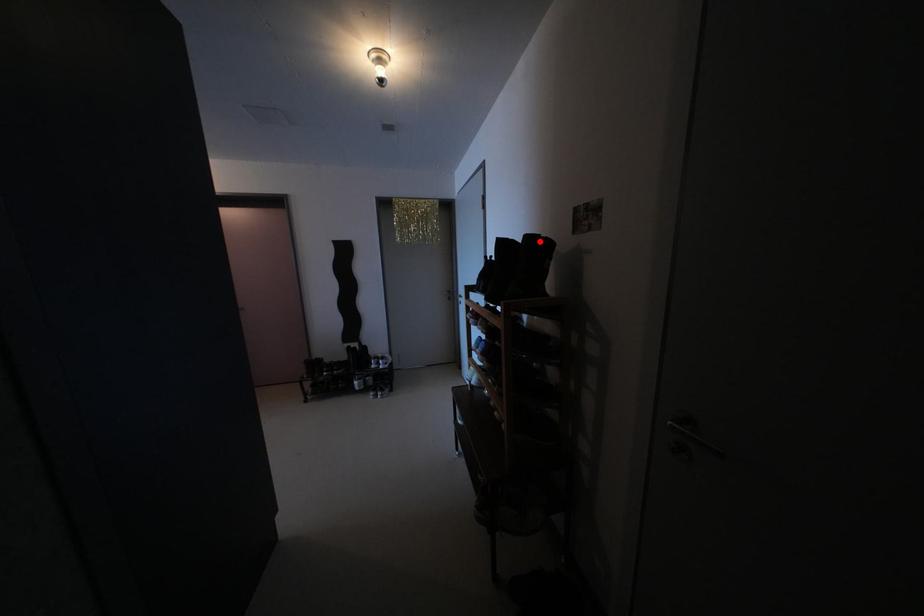
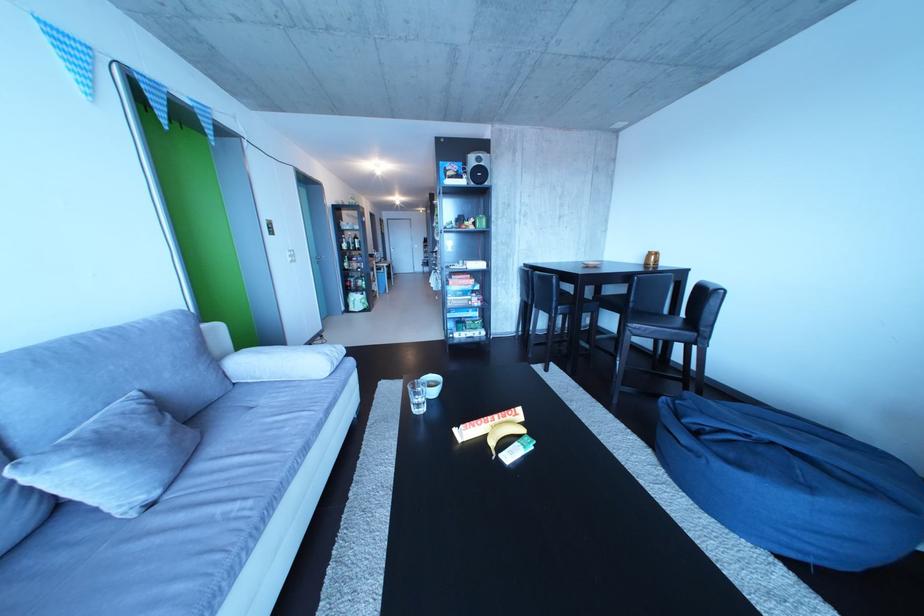
Question: I am providing you with two images of the same scene from different viewpoints. A red point is marked on the first image. At the location where the point appears in image 1, is it still visible in image 2?

Choices:
 (A) Yes
 (B) No

Answer: (B)